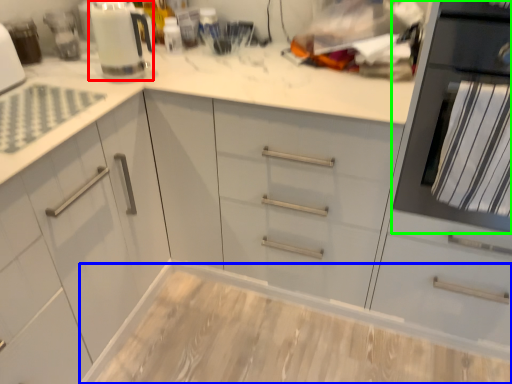
Question: Estimate the real-world distances between objects in this image. Which object is closer to kitchen appliance (highlighted by a red box), counter (highlighted by a blue box) or home appliance (highlighted by a green box)?

Choices:
 (A) counter
 (B) home appliance

Answer: (B)